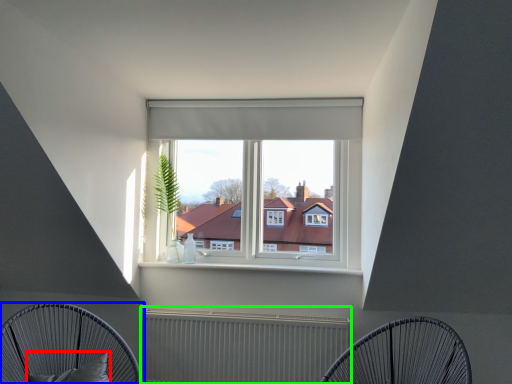
Question: Which is farther away from pillow (highlighted by a red box)? furniture (highlighted by a blue box) or radiator (highlighted by a green box)?

Choices:
 (A) furniture
 (B) radiator

Answer: (B)